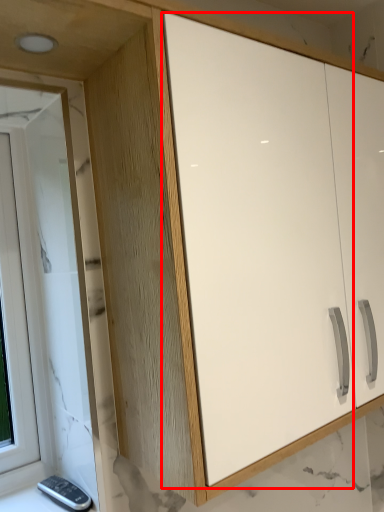
Question: Where is screen door (annotated by the red box) located in relation to window in the image?

Choices:
 (A) right
 (B) left

Answer: (A)